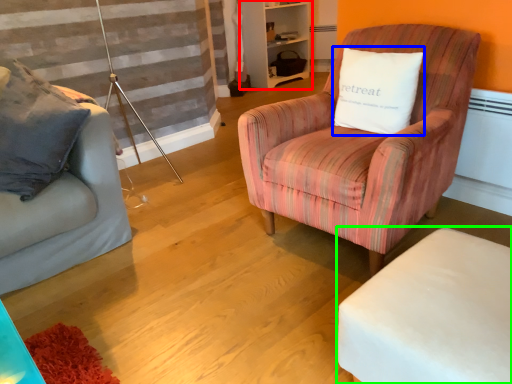
Question: Considering the real-world distances, which object is closest to bookshelf (highlighted by a red box)? pillow (highlighted by a blue box) or table (highlighted by a green box).

Choices:
 (A) pillow
 (B) table

Answer: (A)